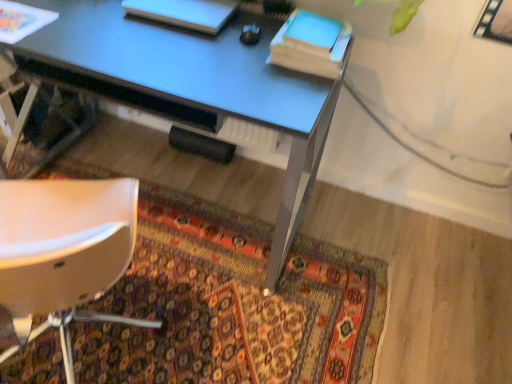
This screenshot has width=512, height=384. What do you see at coordinates (184, 13) in the screenshot? I see `white matte book at upper center, marked as the second book in a right-to-left arrangement` at bounding box center [184, 13].

What are the coordinates of `blue matte notepad at upper right` in the screenshot? It's located at (312, 33).

What is the approximate width of metallic blue desk at center?

24.89 inches.

You are a GUI agent. You are given a task and a screenshot of the screen. Output one action in this format:
    pyautogui.click(x=<x>, y=<y>)
    Task: Click on the metallic blue desk at center
    This screenshot has width=512, height=384.
    Given the screenshot: What is the action you would take?
    pyautogui.click(x=192, y=84)

What is the approximate width of matte blue book at upper right, which ranks as the 1th book in right-to-left order?

The width of matte blue book at upper right, which ranks as the 1th book in right-to-left order, is 31.35 centimeters.

Describe the element at coordinates (232, 305) in the screenshot. I see `carpeted rug at lower center` at that location.

This screenshot has height=384, width=512. In order to click on white matte book at upper center, marked as the second book in a right-to-left arrangement in this screenshot , I will do `click(184, 13)`.

Considering the relative positions of metallic blue desk at center and matte blue book at upper right, positioned as the second book in left-to-right order, in the image provided, is metallic blue desk at center to the left of matte blue book at upper right, positioned as the second book in left-to-right order, from the viewer's perspective?

Indeed, metallic blue desk at center is positioned on the left side of matte blue book at upper right, positioned as the second book in left-to-right order.

Image resolution: width=512 pixels, height=384 pixels. Find the location of `book that is the 2nd object above the metallic blue desk at center (from a real-world perspective)`. book that is the 2nd object above the metallic blue desk at center (from a real-world perspective) is located at coordinates (311, 44).

Is metallic blue desk at center surrounding matte blue book at upper right, positioned as the second book in left-to-right order?

Actually, matte blue book at upper right, positioned as the second book in left-to-right order, is outside metallic blue desk at center.

From the image's perspective, is metallic blue desk at center beneath matte blue book at upper right, which ranks as the 1th book in right-to-left order?

Indeed, from the image's perspective, metallic blue desk at center is shown beneath matte blue book at upper right, which ranks as the 1th book in right-to-left order.

Consider the image. From a real-world perspective, which object rests below the other?

In real-world perspective, matte blue book at upper right, which ranks as the 1th book in right-to-left order, is lower.

In the image, is blue matte notepad at upper right positioned in front of or behind matte blue book at upper right, positioned as the second book in left-to-right order?

blue matte notepad at upper right is positioned farther from the viewer than matte blue book at upper right, positioned as the second book in left-to-right order.

The height and width of the screenshot is (384, 512). Identify the location of notepad behind the matte blue book at upper right, which ranks as the 1th book in right-to-left order. 312,33.

Which object is positioned more to the left, matte blue book at upper right, positioned as the second book in left-to-right order, or blue matte notepad at upper right?

Positioned to the left is matte blue book at upper right, positioned as the second book in left-to-right order.

Can you see matte blue book at upper right, positioned as the second book in left-to-right order, touching blue matte notepad at upper right?

Yes, matte blue book at upper right, positioned as the second book in left-to-right order, is in contact with blue matte notepad at upper right.

From a real-world perspective, which is physically above, matte blue book at upper right, positioned as the second book in left-to-right order, or blue matte notepad at upper right?

In real-world perspective, blue matte notepad at upper right is above.

Is point (350, 29) farther from viewer compared to point (328, 31)?

Yes, point (350, 29) is behind point (328, 31).

From a real-world perspective, between matte blue book at upper right, which ranks as the 1th book in right-to-left order, and white matte book at upper center, marked as the second book in a right-to-left arrangement, who is vertically higher?

From a 3D spatial view, matte blue book at upper right, which ranks as the 1th book in right-to-left order, is above.

Are matte blue book at upper right, which ranks as the 1th book in right-to-left order, and white matte book at upper center, the first book in the left-to-right sequence, making contact?

No, matte blue book at upper right, which ranks as the 1th book in right-to-left order, is not with white matte book at upper center, the first book in the left-to-right sequence.

Is matte blue book at upper right, which ranks as the 1th book in right-to-left order, aimed at white matte book at upper center, marked as the second book in a right-to-left arrangement?

No, matte blue book at upper right, which ranks as the 1th book in right-to-left order, is not aimed at white matte book at upper center, marked as the second book in a right-to-left arrangement.

Is matte blue book at upper right, which ranks as the 1th book in right-to-left order, not within white matte book at upper center, the first book in the left-to-right sequence?

matte blue book at upper right, which ranks as the 1th book in right-to-left order, lies outside white matte book at upper center, the first book in the left-to-right sequence,'s area.

Is there a large distance between white plastic chair at lower left and matte blue book at upper right, positioned as the second book in left-to-right order?

white plastic chair at lower left is near matte blue book at upper right, positioned as the second book in left-to-right order, not far away.

How many degrees apart are the facing directions of white plastic chair at lower left and matte blue book at upper right, positioned as the second book in left-to-right order?

The angular difference between white plastic chair at lower left and matte blue book at upper right, positioned as the second book in left-to-right order, is 154 degrees.

Which object is wider, white plastic chair at lower left or matte blue book at upper right, which ranks as the 1th book in right-to-left order?

With larger width is white plastic chair at lower left.

Considering the positions of objects white plastic chair at lower left and matte blue book at upper right, positioned as the second book in left-to-right order, in the image provided, who is behind, white plastic chair at lower left or matte blue book at upper right, positioned as the second book in left-to-right order,?

matte blue book at upper right, positioned as the second book in left-to-right order, is more distant.

From the image's perspective, who appears lower, white plastic chair at lower left or metallic blue desk at center?

white plastic chair at lower left.

What's the angular difference between white plastic chair at lower left and metallic blue desk at center's facing directions?

The angular difference between white plastic chair at lower left and metallic blue desk at center is 154 degrees.

Does point (59, 288) appear closer or farther from the camera than point (288, 220)?

Clearly, point (59, 288) is closer to the camera than point (288, 220).

Between white plastic chair at lower left and metallic blue desk at center, which one appears on the right side from the viewer's perspective?

From the viewer's perspective, metallic blue desk at center appears more on the right side.

Locate an element on the screen. This screenshot has height=384, width=512. chair lying below the blue matte notepad at upper right (from the image's perspective) is located at coordinates (64, 253).

Between white plastic chair at lower left and blue matte notepad at upper right, which one is positioned behind?

→ blue matte notepad at upper right is further away from the camera.

Is white plastic chair at lower left taller or shorter than blue matte notepad at upper right?

Clearly, white plastic chair at lower left is taller compared to blue matte notepad at upper right.

How different are the orientations of white plastic chair at lower left and blue matte notepad at upper right in degrees?

white plastic chair at lower left and blue matte notepad at upper right are facing 154 degrees away from each other.

The height and width of the screenshot is (384, 512). What are the coordinates of `desk lying in front of the matte blue book at upper right, positioned as the second book in left-to-right order` in the screenshot? It's located at (192, 84).

Image resolution: width=512 pixels, height=384 pixels. Identify the location of book below the blue matte notepad at upper right (from the image's perspective). (311, 44).

Based on their spatial positions, is carpeted rug at lower center or metallic blue desk at center further from white matte book at upper center, the first book in the left-to-right sequence?

Based on the image, carpeted rug at lower center appears to be further to white matte book at upper center, the first book in the left-to-right sequence.

When comparing their distances from metallic blue desk at center, does white matte book at upper center, the first book in the left-to-right sequence, or matte blue book at upper right, which ranks as the 1th book in right-to-left order, seem further?

matte blue book at upper right, which ranks as the 1th book in right-to-left order, is positioned further to the anchor metallic blue desk at center.

Which object lies further to the anchor point blue matte notepad at upper right, metallic blue desk at center or carpeted rug at lower center?

Among the two, carpeted rug at lower center is located further to blue matte notepad at upper right.

Considering their positions, is carpeted rug at lower center positioned further to white plastic chair at lower left than matte blue book at upper right, positioned as the second book in left-to-right order?

matte blue book at upper right, positioned as the second book in left-to-right order, lies further to white plastic chair at lower left than the other object.

Looking at the image, which one is located closer to white matte book at upper center, the first book in the left-to-right sequence, carpeted rug at lower center or white plastic chair at lower left?

white plastic chair at lower left is positioned closer to the anchor white matte book at upper center, the first book in the left-to-right sequence.

Considering their positions, is blue matte notepad at upper right positioned further to white plastic chair at lower left than matte blue book at upper right, positioned as the second book in left-to-right order?

Based on the image, blue matte notepad at upper right appears to be further to white plastic chair at lower left.

Based on their spatial positions, is white matte book at upper center, marked as the second book in a right-to-left arrangement, or carpeted rug at lower center further from metallic blue desk at center?

The object further to metallic blue desk at center is carpeted rug at lower center.

When comparing their distances from matte blue book at upper right, positioned as the second book in left-to-right order, does white plastic chair at lower left or blue matte notepad at upper right seem further?

white plastic chair at lower left is positioned further to the anchor matte blue book at upper right, positioned as the second book in left-to-right order.

Image resolution: width=512 pixels, height=384 pixels. In order to click on book located between white matte book at upper center, marked as the second book in a right-to-left arrangement, and blue matte notepad at upper right in the left-right direction in this screenshot , I will do `click(311, 44)`.

Where is `book between white matte book at upper center, marked as the second book in a right-to-left arrangement, and carpeted rug at lower center from top to bottom`? Image resolution: width=512 pixels, height=384 pixels. book between white matte book at upper center, marked as the second book in a right-to-left arrangement, and carpeted rug at lower center from top to bottom is located at coordinates (311, 44).

You are a GUI agent. You are given a task and a screenshot of the screen. Output one action in this format:
    pyautogui.click(x=<x>, y=<y>)
    Task: Click on the desk that lies between white matte book at upper center, marked as the second book in a right-to-left arrangement, and carpeted rug at lower center from top to bottom
    The height and width of the screenshot is (384, 512).
    Given the screenshot: What is the action you would take?
    pyautogui.click(x=192, y=84)

Where is `desk between blue matte notepad at upper right and carpeted rug at lower center in the up-down direction`? desk between blue matte notepad at upper right and carpeted rug at lower center in the up-down direction is located at coordinates (192, 84).